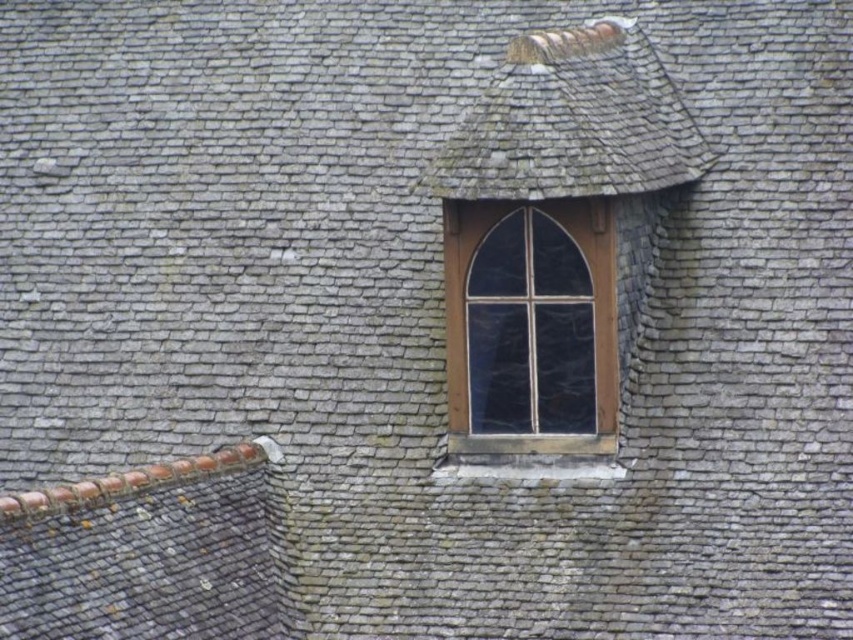
Question: Observing the image, what is the correct spatial positioning of clear glass window at center in reference to gray shingles at upper center?

Choices:
 (A) right
 (B) left

Answer: (B)

Question: Among these points, which one is nearest to the camera?

Choices:
 (A) (555, 413)
 (B) (451, 134)

Answer: (A)

Question: Which object is farther from the camera taking this photo?

Choices:
 (A) gray shingles at upper center
 (B) clear glass window at center

Answer: (B)

Question: Does clear glass window at center come behind gray shingles at upper center?

Choices:
 (A) yes
 (B) no

Answer: (A)

Question: Does clear glass window at center have a lesser width compared to gray shingles at upper center?

Choices:
 (A) yes
 (B) no

Answer: (A)